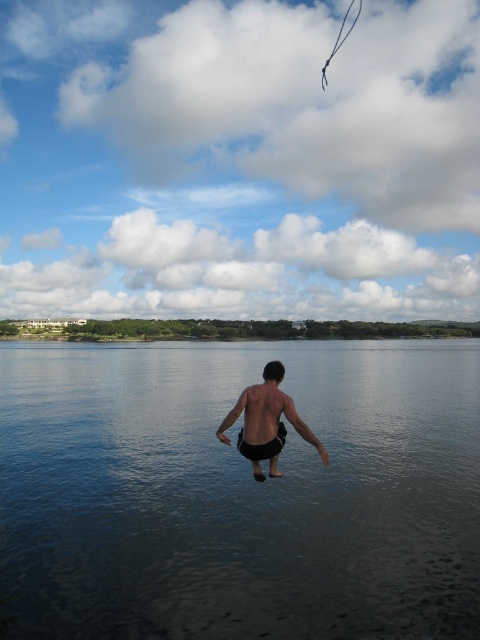
You are a photographer planning to capture the perfect shot of the scene. You want to ensure that the dark blue water at center and the black matte shorts at center are both visible in the frame. Based on their relative heights, which object should appear higher in the photograph?

The dark blue water at center has a greater height compared to the black matte shorts at center, so it will appear higher in the photograph.